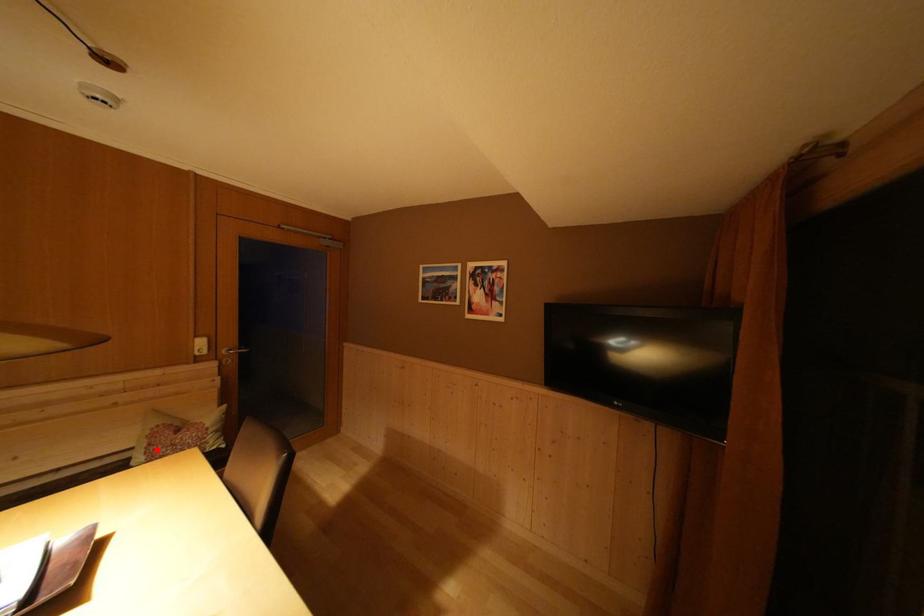
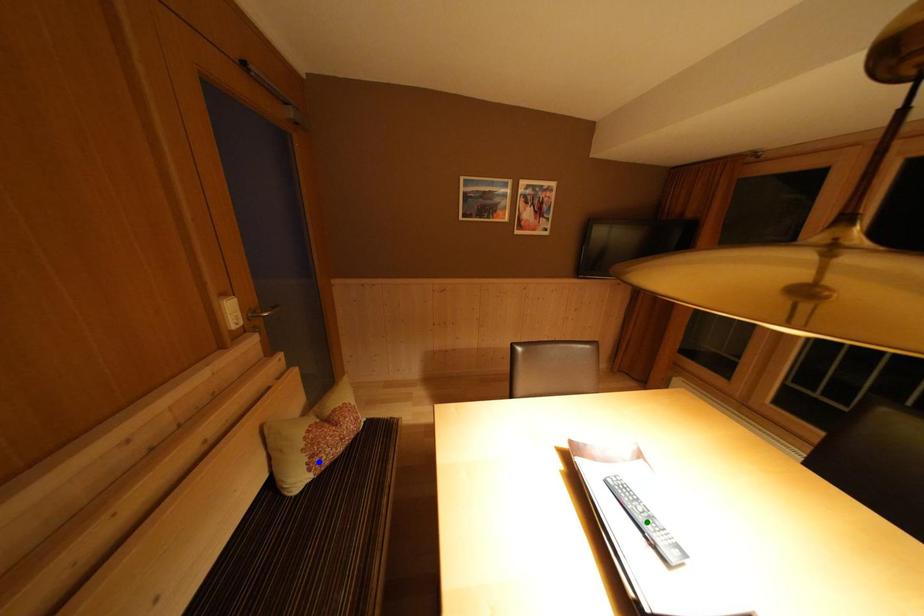
Question: I am providing you with two images of the same scene from different viewpoints. A red point is marked on the first image. You are given multiple points on the second image. In image 2, which mark is for the same physical point as the one in image 1?

Choices:
 (A) yellow point
 (B) green point
 (C) blue point

Answer: (C)